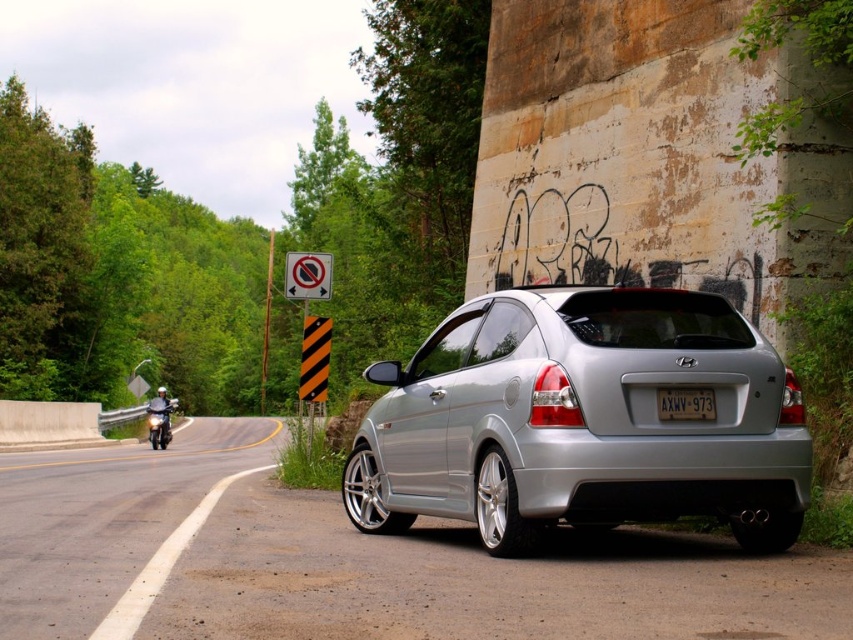
Is silver metallic car at lower right positioned in front of white plastic license plate at center?

That is True.

Which is more to the right, silver metallic car at lower right or white plastic license plate at center?

Positioned to the right is white plastic license plate at center.

Find the location of a particular element. The width and height of the screenshot is (853, 640). silver metallic car at lower right is located at coordinates (352, 563).

Identify the location of silver metallic car at lower right. click(x=352, y=563).

Is point (71, 502) positioned before point (158, 392)?

Yes, it is.

Does white asphalt road at lower left lie behind brushed metal helmet at left?

No.

Does point (161, 532) come closer to viewer compared to point (165, 428)?

Yes, point (161, 532) is closer to viewer.

Where is `white asphalt road at lower left`? The width and height of the screenshot is (853, 640). white asphalt road at lower left is located at coordinates (109, 520).

Is satin silver hatchback at center above brushed metal helmet at left?

Indeed, satin silver hatchback at center is positioned over brushed metal helmet at left.

You are a GUI agent. You are given a task and a screenshot of the screen. Output one action in this format:
    pyautogui.click(x=<x>, y=<y>)
    Task: Click on the satin silver hatchback at center
    
    Given the screenshot: What is the action you would take?
    pyautogui.click(x=582, y=420)

Is point (622, 360) positioned behind point (160, 417)?

No, (622, 360) is closer to viewer.

Locate an element on the screen. The height and width of the screenshot is (640, 853). satin silver hatchback at center is located at coordinates (582, 420).